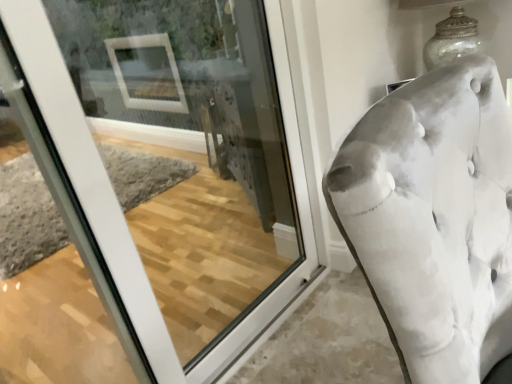
The image size is (512, 384). What are the coordinates of `vacant space underneath transparent glass window at center (from a real-world perspective)` in the screenshot? It's located at tap(266, 332).